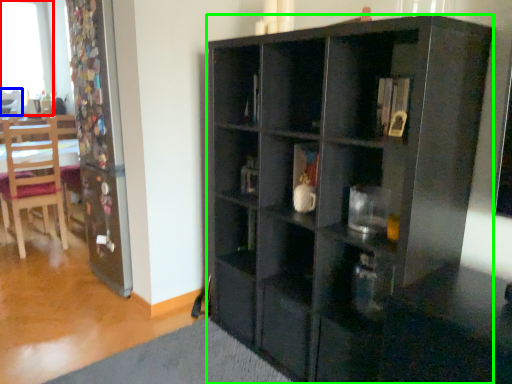
Question: Which object is the closest to the window (highlighted by a red box)? Choose among these: chair (highlighted by a blue box) or cabinetry (highlighted by a green box).

Choices:
 (A) chair
 (B) cabinetry

Answer: (A)